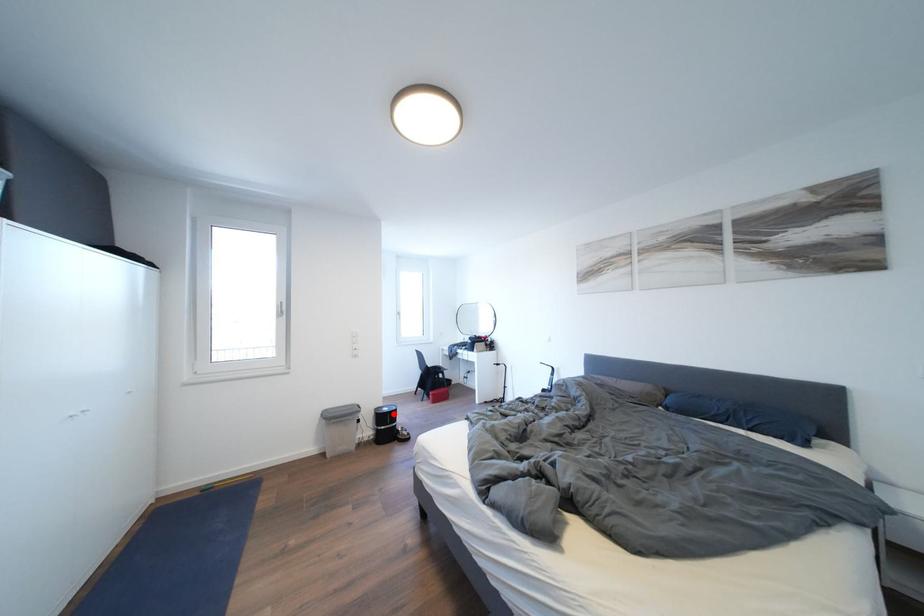
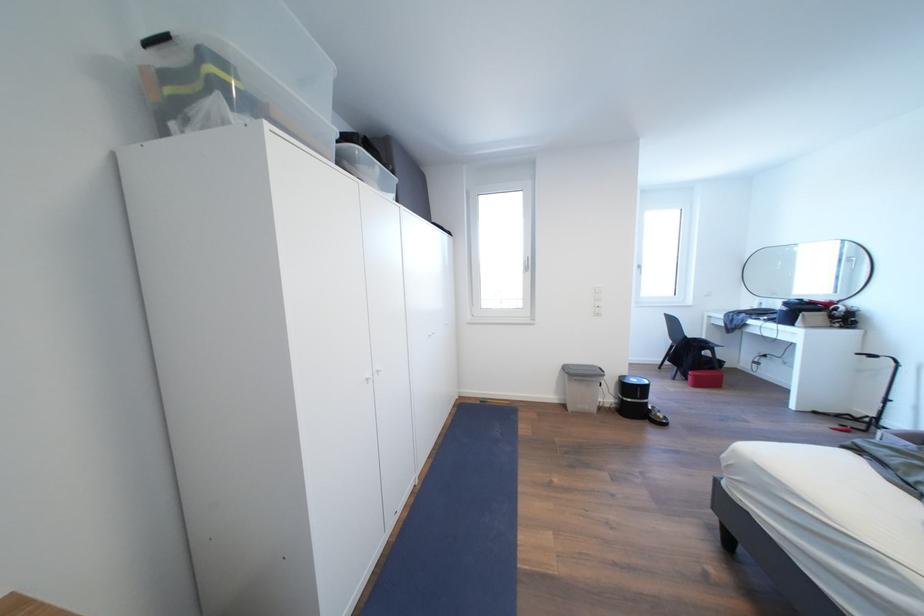
Locate, in the second image, the point that corresponds to the highlighted location in the first image.

(641, 386)